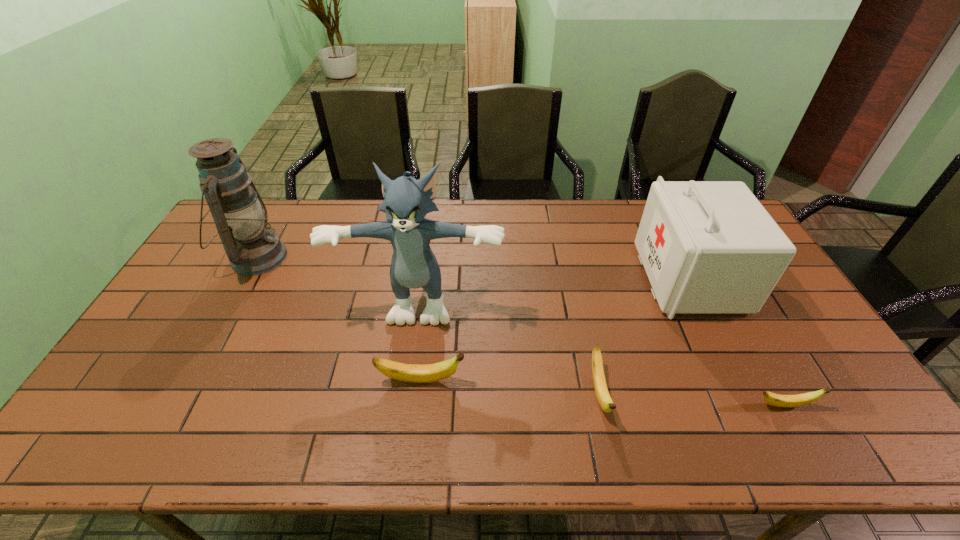
Where is `empty location between the first-aid kit and the cat`? empty location between the first-aid kit and the cat is located at coordinates click(x=555, y=287).

Where is `vacant area that lies between the leftmost banana and the fourth shortest object`? The width and height of the screenshot is (960, 540). vacant area that lies between the leftmost banana and the fourth shortest object is located at coordinates (555, 329).

The height and width of the screenshot is (540, 960). In order to click on vacant space that is in between the third tallest object and the shortest object in this screenshot , I will do `click(736, 342)`.

Locate an element on the screen. Image resolution: width=960 pixels, height=540 pixels. unoccupied position between the third tallest object and the shortest object is located at coordinates (736, 342).

This screenshot has width=960, height=540. I want to click on free space that is in between the leftmost object and the third tallest object, so (473, 268).

Where is `vacant area between the fourth tallest object and the cat`? vacant area between the fourth tallest object and the cat is located at coordinates (421, 338).

Identify the location of object that stands as the closest to the second tallest banana. (407, 201).

At what (x,y) coordinates should I click in order to perform the action: click on object that ranks as the fifth closest to the leftmost object. Please return your answer as a coordinate pair (x, y). This screenshot has width=960, height=540. Looking at the image, I should click on (787, 401).

Locate an element on the screen. This screenshot has height=540, width=960. banana that is the third closest one to the cat is located at coordinates (787, 401).

Identify which banana is the nearest to the second shortest object. Please provide its 2D coordinates. Your answer should be formatted as a tuple, i.e. [(x, y)], where the tuple contains the x and y coordinates of a point satisfying the conditions above.

[(418, 373)]